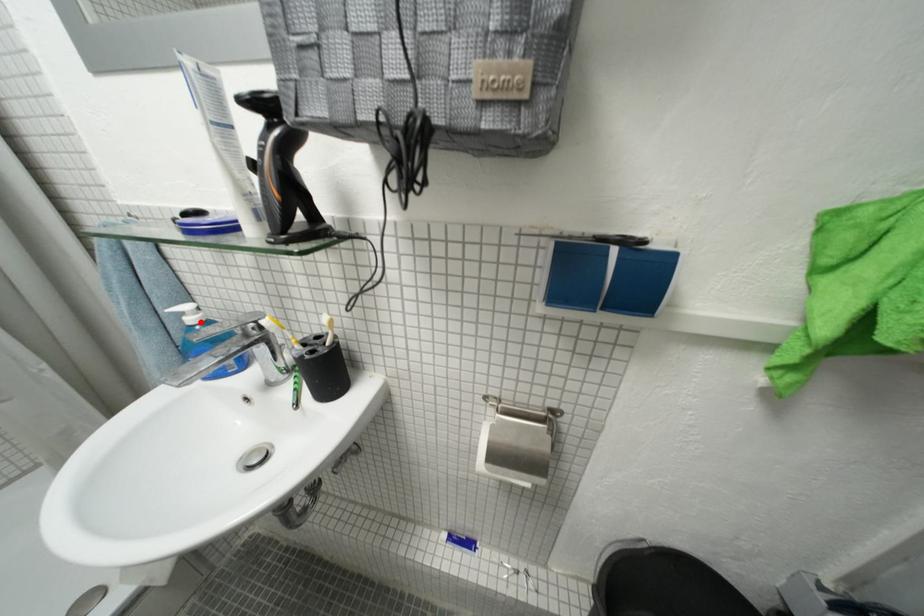
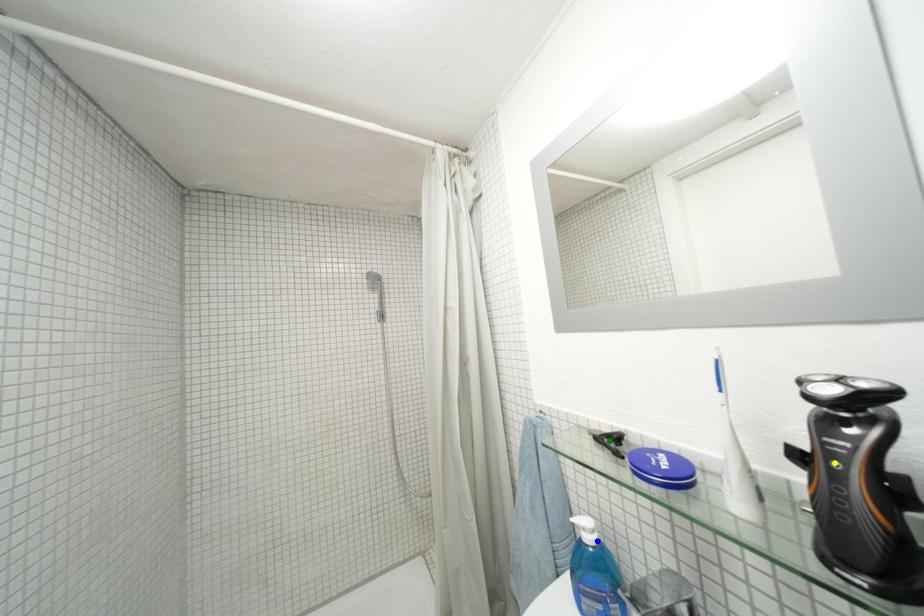
Question: I am providing you with two images of the same scene from different viewpoints. A red point is marked on the first image. You are given multiple points on the second image. In image 2, which mark is for the same physical point as the one in image 1?

Choices:
 (A) green point
 (B) yellow point
 (C) blue point

Answer: (C)